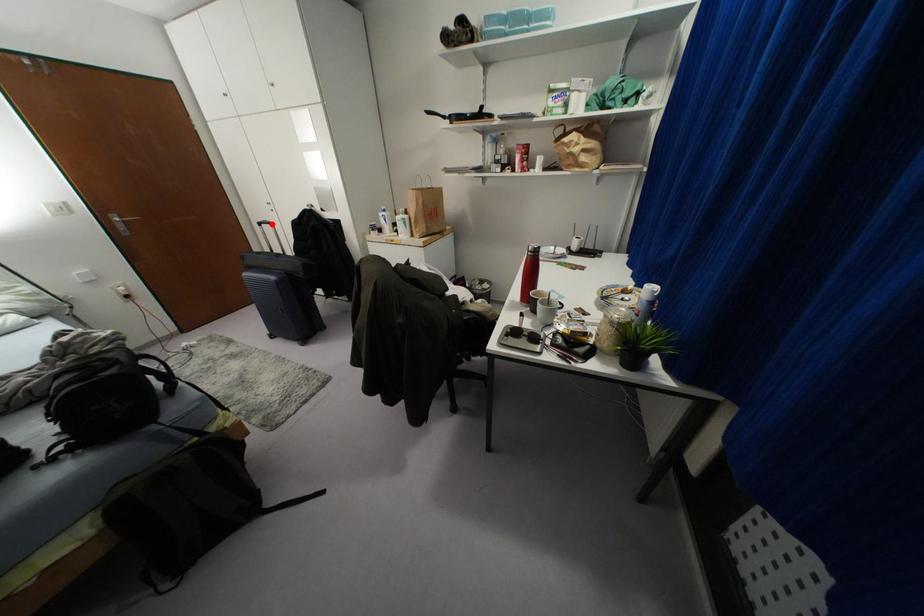
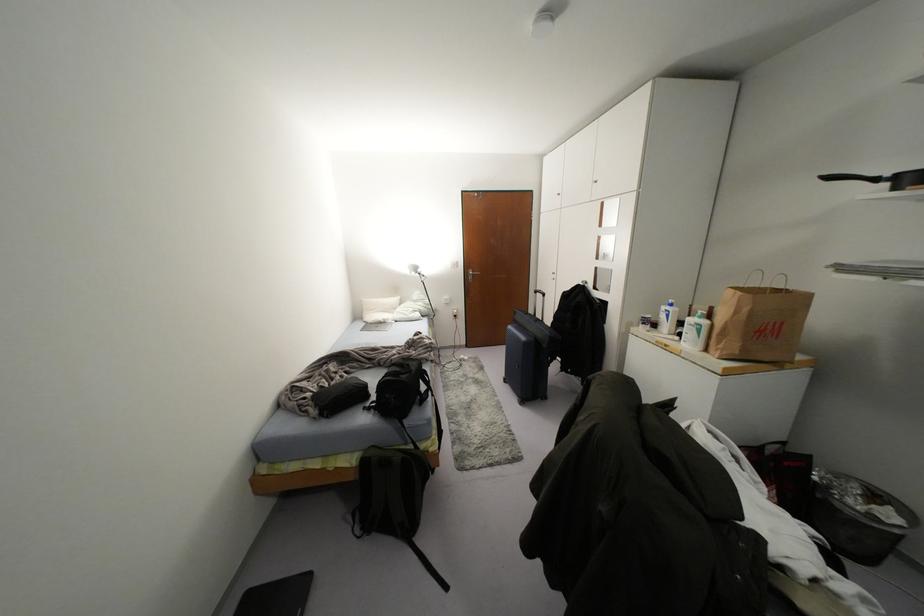
The point at the highlighted location is marked in the first image. Where is the corresponding point in the second image?

(542, 294)